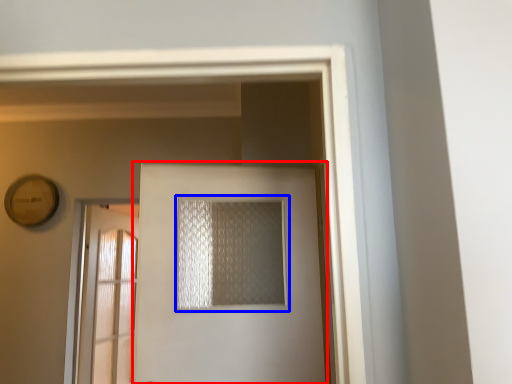
Question: Which point is closer to the camera, door (highlighted by a red box) or window (highlighted by a blue box)?

Choices:
 (A) door
 (B) window

Answer: (A)